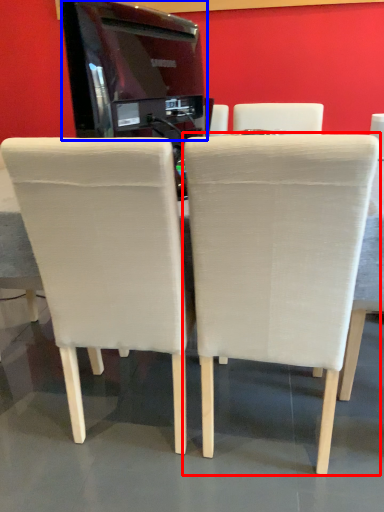
Question: Which point is further to the camera, chair (highlighted by a red box) or appliance (highlighted by a blue box)?

Choices:
 (A) chair
 (B) appliance

Answer: (B)